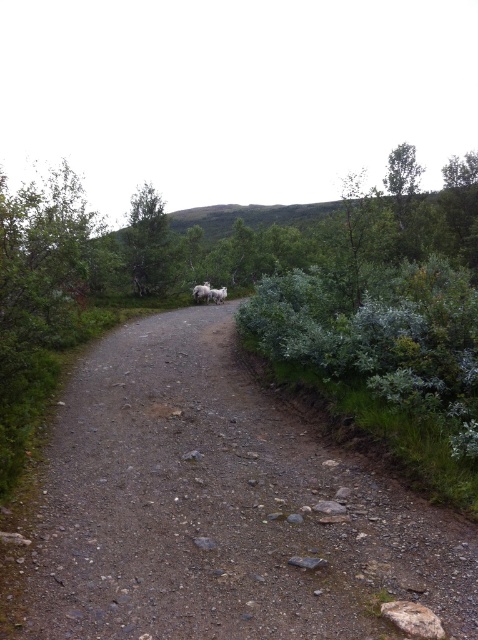
You are a hiker carrying a large backpack and need to walk along the dusty gravel path at center. Considering the path is narrower than the green leafy tree at upper center, will you have enough space to pass through comfortably?

The dusty gravel path at center is narrower than the green leafy tree at upper center, so the path may be too narrow for comfortable passage with a large backpack. Consider checking for a wider path or adjusting your load.

You are a hiker standing at the start of the dusty gravel path at center. You want to reach the green leafy tree at upper center. Which direction should you walk to get there?

The dusty gravel path at center is to the right of green leafy tree at upper center, so you should walk to the left to reach the green leafy tree at upper center.

You are a hiker planning to walk along the dusty gravel path at center. You notice the green leafy tree at upper center in the distance. Which object takes up more area in the image?

The green leafy tree at upper center occupies more space than the dusty gravel path at center in the image.